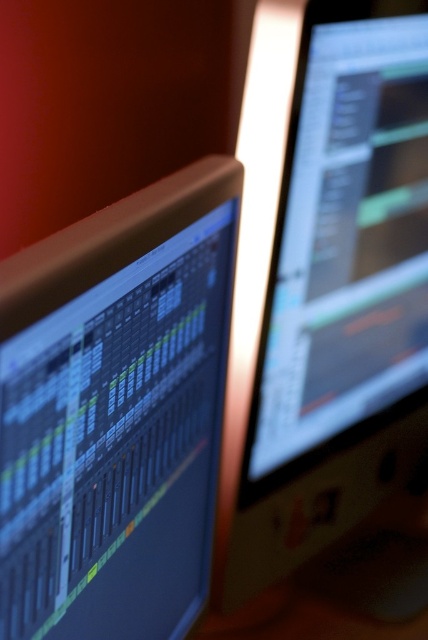
You are setting up a workspace and want to place a new keyboard between the two monitors. The keyboard requires a minimum of 50 cm of space between the edges of the monitors to fit. Based on the scene, can the keyboard be placed between the matte black monitor at left and the satin black monitor at upper right?

The matte black monitor at left is narrower than the satin black monitor at upper right, but the question is about the distance between them. The provided information only states the width of the monitors, not the distance between their edges. Without knowing the actual spacing between the monitors, it is impossible to determine if the 50 cm requirement is met.

You are setting up a new desk and need to know the arrangement of the two monitors. Based on the scene, which monitor is closer to you, the matte black monitor at left or the satin black monitor at upper right?

The matte black monitor at left is closer to you because it is in front of the satin black monitor at upper right, meaning the latter is placed further back.

You are a technician inspecting the workspace. You notice two points marked on the monitors. The first point is at coordinates point (73, 433) and the second is at point (311, 292). Which point is nearer to the viewer?

Point (73, 433) is closer to the viewer than point (311, 292).